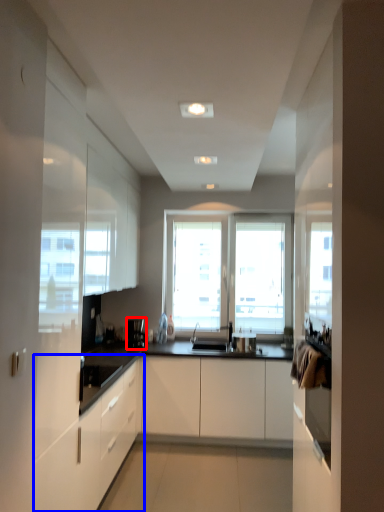
Question: Which of the following is the closest to the observer, coffee machine (highlighted by a red box) or cabinetry (highlighted by a blue box)?

Choices:
 (A) coffee machine
 (B) cabinetry

Answer: (B)